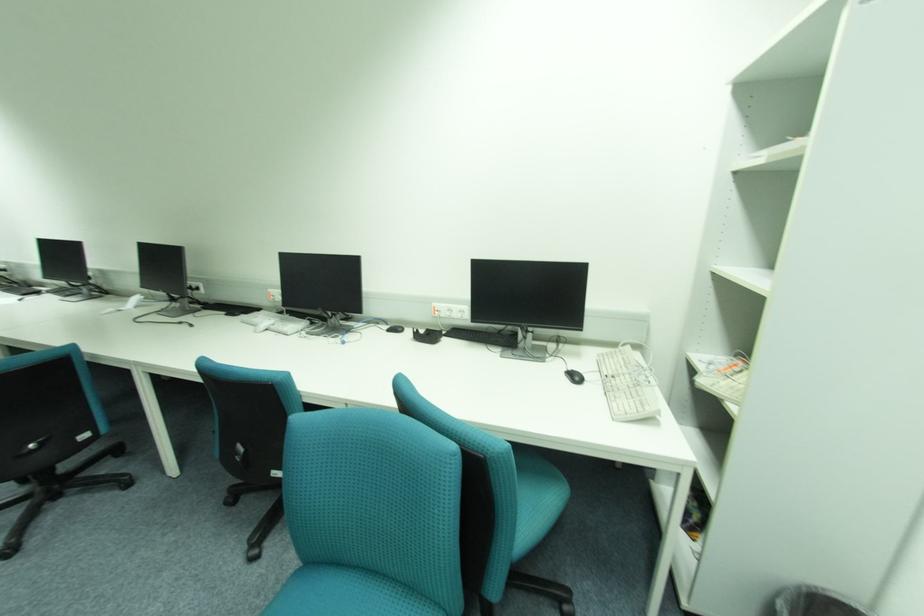
Which object does [627,385] point to?

It corresponds to the white computer keyboard in the image.